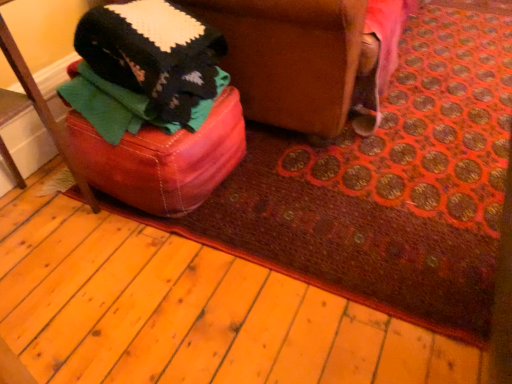
Image resolution: width=512 pixels, height=384 pixels. Identify the location of free spot to the right of leather ottoman at left. (117, 272).